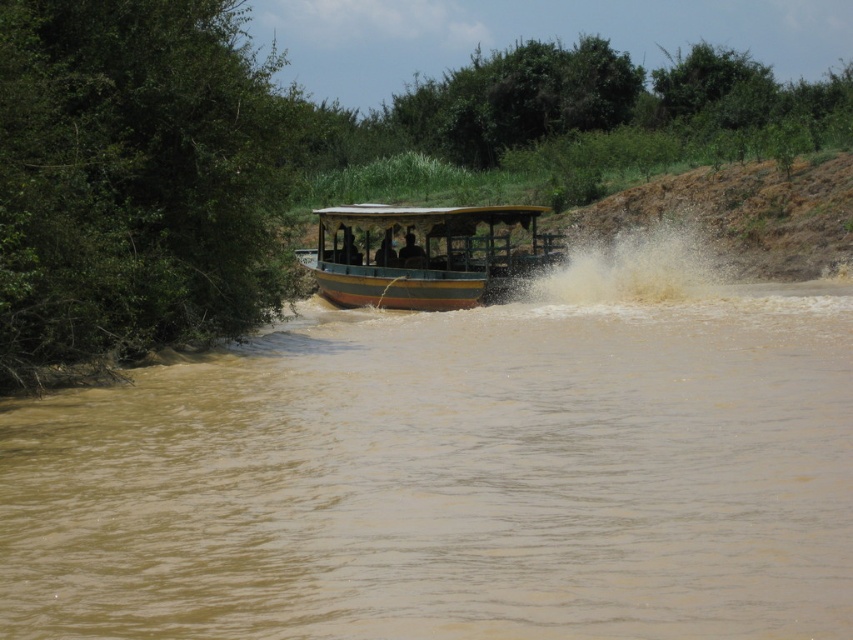
You are a passenger on the boat and want to know where the brown muddy water at center is located. Can you describe its position relative to the boat?

The brown muddy water at center is located at point (451, 481) relative to the boat.

You are a passenger on the wooden boat at center. You want to know if the brown muddy water at center is higher or lower than the boat. Can you determine this based on the scene?

The brown muddy water at center is not as tall as wooden boat at center, so the water is lower than the boat.